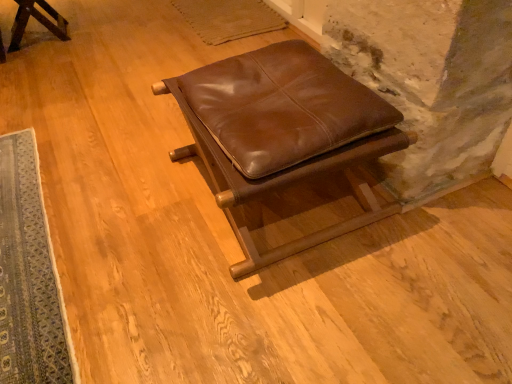
Question: Considering the relative sizes of matte brown leather stool at upper left, marked as the second furniture in a front-to-back arrangement, and brown leather ottoman at center, which ranks as the first furniture in bottom-to-top order, in the image provided, is matte brown leather stool at upper left, marked as the second furniture in a front-to-back arrangement, taller than brown leather ottoman at center, which ranks as the first furniture in bottom-to-top order,?

Choices:
 (A) no
 (B) yes

Answer: (A)

Question: Does matte brown leather stool at upper left, placed as the 2th furniture when sorted from right to left, have a lesser height compared to brown leather ottoman at center, which ranks as the first furniture in bottom-to-top order?

Choices:
 (A) no
 (B) yes

Answer: (B)

Question: Is matte brown leather stool at upper left, the first furniture when ordered from top to bottom, not close to brown leather ottoman at center, arranged as the second furniture when viewed from the left?

Choices:
 (A) yes
 (B) no

Answer: (A)

Question: Is matte brown leather stool at upper left, the 1th furniture viewed from the left, closer to camera compared to brown leather ottoman at center, arranged as the second furniture when viewed from the left?

Choices:
 (A) yes
 (B) no

Answer: (B)

Question: Can you confirm if matte brown leather stool at upper left, the first furniture when ordered from top to bottom, is thinner than brown leather ottoman at center, arranged as the second furniture when viewed from the left?

Choices:
 (A) yes
 (B) no

Answer: (A)

Question: From a real-world perspective, is matte brown leather stool at upper left, the first furniture when ordered from top to bottom, located higher than brown leather ottoman at center, which appears as the first furniture when viewed from the front?

Choices:
 (A) no
 (B) yes

Answer: (A)

Question: Does blue woven rug at lower left have a smaller size compared to matte brown leather stool at upper left, the 1th furniture viewed from the left?

Choices:
 (A) yes
 (B) no

Answer: (A)

Question: Does blue woven rug at lower left come behind matte brown leather stool at upper left, the first furniture when ordered from top to bottom?

Choices:
 (A) yes
 (B) no

Answer: (B)

Question: Is blue woven rug at lower left looking in the opposite direction of matte brown leather stool at upper left, the 1th furniture in the back-to-front sequence?

Choices:
 (A) no
 (B) yes

Answer: (A)

Question: From a real-world perspective, is blue woven rug at lower left physically below matte brown leather stool at upper left, marked as the second furniture in a front-to-back arrangement?

Choices:
 (A) no
 (B) yes

Answer: (B)

Question: Considering the relative positions of blue woven rug at lower left and matte brown leather stool at upper left, marked as the second furniture in a front-to-back arrangement, in the image provided, is blue woven rug at lower left to the left of matte brown leather stool at upper left, marked as the second furniture in a front-to-back arrangement, from the viewer's perspective?

Choices:
 (A) no
 (B) yes

Answer: (A)

Question: Does blue woven rug at lower left have a larger size compared to matte brown leather stool at upper left, marked as the second furniture in a front-to-back arrangement?

Choices:
 (A) yes
 (B) no

Answer: (B)

Question: Is blue woven rug at lower left surrounding brown leather ottoman at center, which is the first furniture in right-to-left order?

Choices:
 (A) yes
 (B) no

Answer: (B)